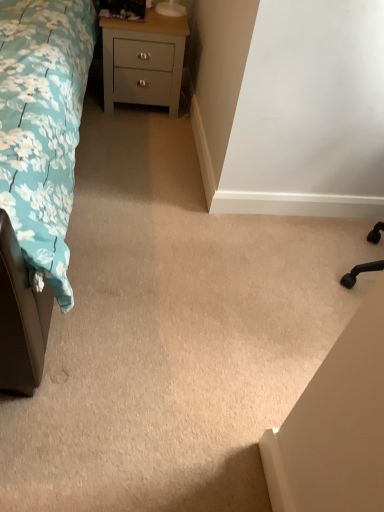
Question: Does teal floral fabric bed at left have a lesser width compared to light gray painted wood chest of drawers at upper left?

Choices:
 (A) no
 (B) yes

Answer: (A)

Question: Is teal floral fabric bed at left wider than light gray painted wood chest of drawers at upper left?

Choices:
 (A) no
 (B) yes

Answer: (B)

Question: Does teal floral fabric bed at left touch light gray painted wood chest of drawers at upper left?

Choices:
 (A) no
 (B) yes

Answer: (A)

Question: Is teal floral fabric bed at left to the right of light gray painted wood chest of drawers at upper left from the viewer's perspective?

Choices:
 (A) no
 (B) yes

Answer: (A)

Question: From the image's perspective, is teal floral fabric bed at left beneath light gray painted wood chest of drawers at upper left?

Choices:
 (A) yes
 (B) no

Answer: (A)

Question: Is teal floral fabric bed at left bigger than light gray painted wood chest of drawers at upper left?

Choices:
 (A) no
 (B) yes

Answer: (B)

Question: From a real-world perspective, is light gray painted wood chest of drawers at upper left over teal floral fabric bed at left?

Choices:
 (A) yes
 (B) no

Answer: (B)

Question: From the image's perspective, does light gray painted wood chest of drawers at upper left appear higher than teal floral fabric bed at left?

Choices:
 (A) yes
 (B) no

Answer: (A)

Question: Would you say light gray painted wood chest of drawers at upper left is outside teal floral fabric bed at left?

Choices:
 (A) no
 (B) yes

Answer: (B)

Question: Does light gray painted wood chest of drawers at upper left come in front of teal floral fabric bed at left?

Choices:
 (A) no
 (B) yes

Answer: (A)

Question: Is light gray painted wood chest of drawers at upper left at the left side of teal floral fabric bed at left?

Choices:
 (A) yes
 (B) no

Answer: (B)

Question: Considering the relative positions of light gray painted wood chest of drawers at upper left and teal floral fabric bed at left in the image provided, is light gray painted wood chest of drawers at upper left to the right of teal floral fabric bed at left from the viewer's perspective?

Choices:
 (A) yes
 (B) no

Answer: (A)

Question: Is light gray painted wood chest of drawers at upper left to the left or to the right of teal floral fabric bed at left in the image?

Choices:
 (A) right
 (B) left

Answer: (A)